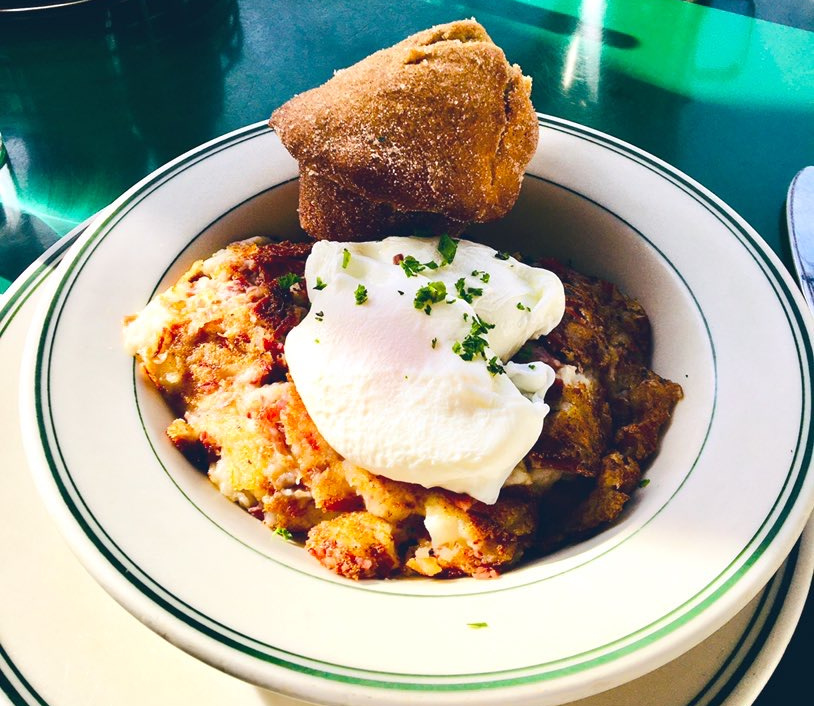
This screenshot has width=814, height=706. I want to click on counter, so click(680, 97).